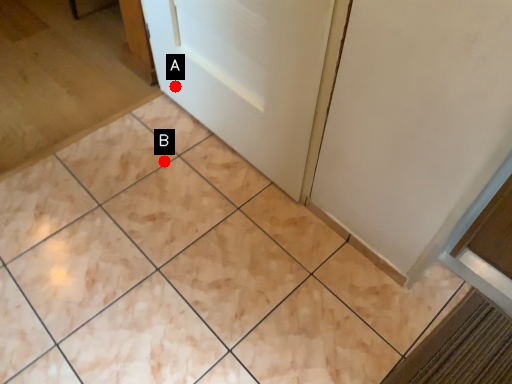
Question: Two points are circled on the image, labeled by A and B beside each circle. Which point is farther to the camera?

Choices:
 (A) A is further
 (B) B is further

Answer: (A)